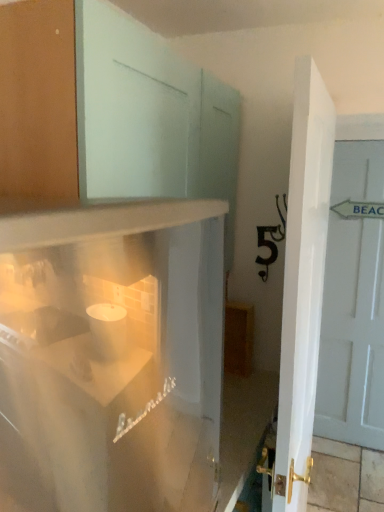
Question: Is white painted wood door at right, the first door positioned from the back, a part of white glossy refrigerator at lower left?

Choices:
 (A) yes
 (B) no

Answer: (B)

Question: From a real-world perspective, is white glossy refrigerator at lower left physically above white painted wood door at right, which is counted as the 1th door, starting from the right?

Choices:
 (A) yes
 (B) no

Answer: (A)

Question: Is white glossy refrigerator at lower left next to white painted wood door at right, the first door positioned from the back, and touching it?

Choices:
 (A) no
 (B) yes

Answer: (A)

Question: From the image's perspective, is white glossy refrigerator at lower left over white painted wood door at right, which is counted as the 1th door, starting from the right?

Choices:
 (A) yes
 (B) no

Answer: (B)

Question: Can you confirm if white glossy refrigerator at lower left is smaller than white painted wood door at right, the 2th door from the left?

Choices:
 (A) yes
 (B) no

Answer: (B)

Question: From the image's perspective, is white glossy refrigerator at lower left above or below white painted wood door at right, which is counted as the 1th door, starting from the right?

Choices:
 (A) above
 (B) below

Answer: (B)

Question: Is white glossy refrigerator at lower left situated inside white painted wood door at right, which is counted as the 1th door, starting from the right, or outside?

Choices:
 (A) outside
 (B) inside

Answer: (A)

Question: Considering the relative positions of white glossy refrigerator at lower left and white painted wood door at right, arranged as the 2th door when viewed from the front, in the image provided, is white glossy refrigerator at lower left to the left or to the right of white painted wood door at right, arranged as the 2th door when viewed from the front,?

Choices:
 (A) left
 (B) right

Answer: (A)

Question: Considering their positions, is white glossy refrigerator at lower left located in front of or behind white painted wood door at right, the first door positioned from the back?

Choices:
 (A) front
 (B) behind

Answer: (A)

Question: From a real-world perspective, is white painted wood door at right, arranged as the 2th door when viewed from the front, positioned above or below white glossy refrigerator at lower left?

Choices:
 (A) below
 (B) above

Answer: (A)

Question: Visually, is white painted wood door at right, the 2th door from the left, positioned to the left or to the right of white glossy refrigerator at lower left?

Choices:
 (A) left
 (B) right

Answer: (B)

Question: Relative to white glossy refrigerator at lower left, is white painted wood door at right, the first door positioned from the back, in front or behind?

Choices:
 (A) behind
 (B) front

Answer: (A)

Question: From the image's perspective, relative to white glossy refrigerator at lower left, is white painted wood door at right, the 2th door from the left, above or below?

Choices:
 (A) below
 (B) above

Answer: (B)

Question: Relative to white glossy door at center, which appears as the 1th door when viewed from the front, is white glossy refrigerator at lower left in front or behind?

Choices:
 (A) behind
 (B) front

Answer: (B)

Question: In the image, is white glossy refrigerator at lower left on the left side or the right side of white glossy door at center, positioned as the first door in left-to-right order?

Choices:
 (A) left
 (B) right

Answer: (A)